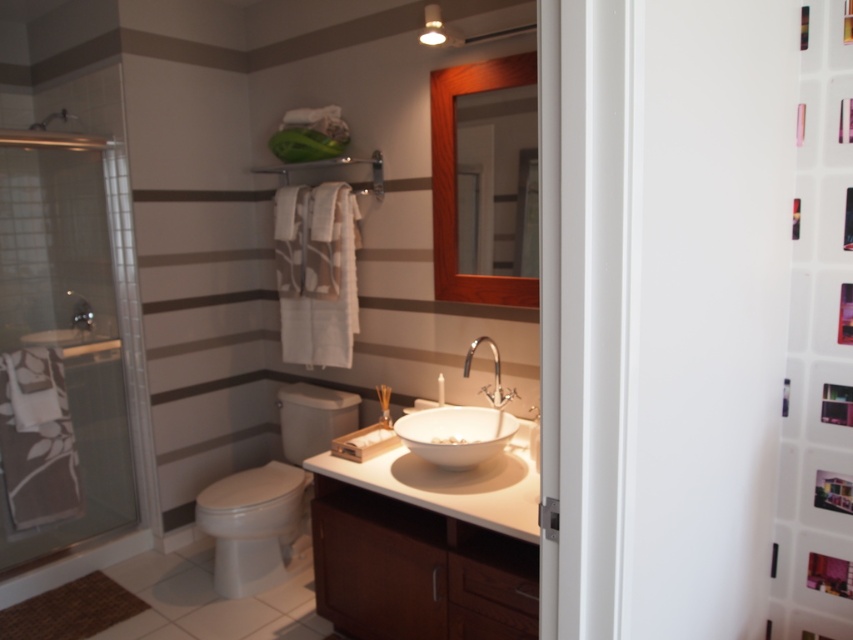
Question: Is transparent glass shower door at left closer to camera compared to wooden mirror at upper center?

Choices:
 (A) yes
 (B) no

Answer: (B)

Question: Is transparent glass shower door at left above polished chrome faucet at center?

Choices:
 (A) yes
 (B) no

Answer: (A)

Question: In this image, where is white glossy screen door at right located relative to transparent glass shower door at left?

Choices:
 (A) above
 (B) below

Answer: (B)

Question: Which object is farther from the camera taking this photo?

Choices:
 (A) white glossy screen door at right
 (B) white ceramic sink at center

Answer: (B)

Question: Which of the following is the farthest from the observer?

Choices:
 (A) polished chrome faucet at center
 (B) wooden mirror at upper center
 (C) white glossy toilet at center
 (D) transparent glass shower door at left

Answer: (C)

Question: Which point is closer to the camera taking this photo?

Choices:
 (A) (471, 358)
 (B) (486, 429)
 (C) (746, 600)
 (D) (32, 346)

Answer: (C)